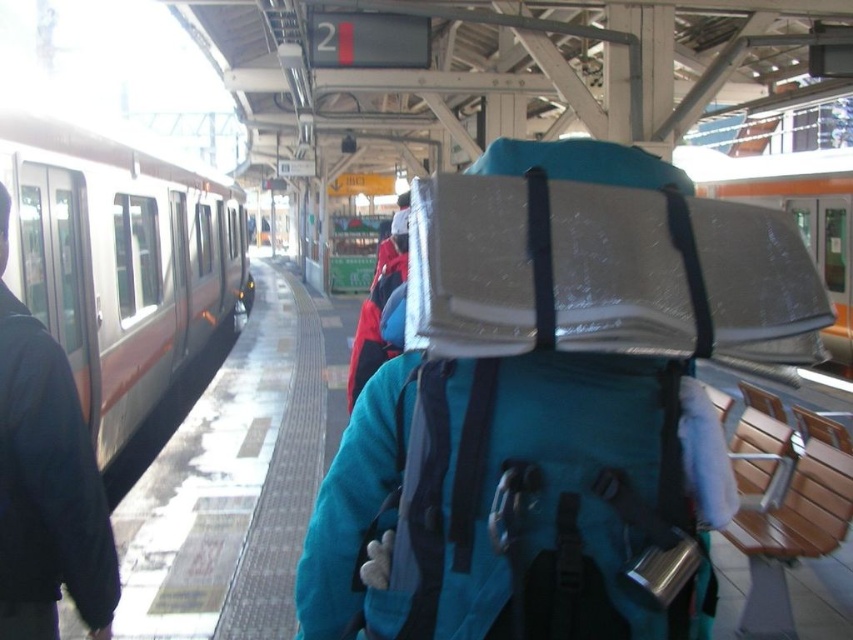
You are a passenger at the train station and want to board the silver metallic train at left. The platform has a safety line 1.5 meters away from the edge. If you are standing at the camera position, will you be able to safely board the train without crossing the safety line?

The distance between the silver metallic train at left and the camera is 3.63 meters. Since the safety line is 1.5 meters from the edge, you can board the train safely as the distance is greater than the safety line requirement.

You are standing at the train station platform and see two points marked on the ground. The first point is at coordinates point (184, 316) and the second is at point (825, 346). Which point is closer to you?

Point (184, 316) is in front of point (825, 346), so it is closer to you.

You are standing at point (45, 483) on the platform. What color is the jacket of the person closest to you?

The dark blue fabric jacket at left is located at point (45, 483), so the closest person to you has a dark blue jacket.